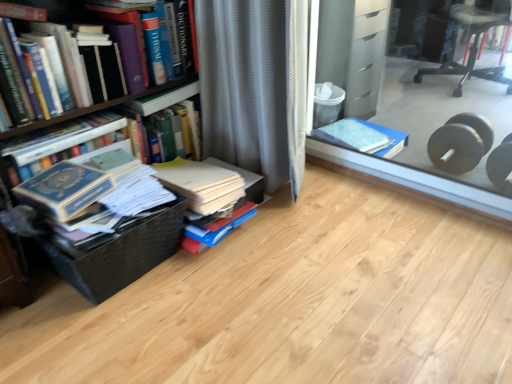
Find the location of `black woven basket at lower left`. black woven basket at lower left is located at coordinates (117, 252).

Image resolution: width=512 pixels, height=384 pixels. What do you see at coordinates (471, 47) in the screenshot?
I see `black plastic chair at upper right` at bounding box center [471, 47].

Find the location of a particular element. This screenshot has width=512, height=384. black woven basket at lower left is located at coordinates (117, 252).

Consider the image. Which object is wider, hardcover book at left, arranged as the 2th book when viewed from the left, or blue cardboard box at center?

Wider between the two is blue cardboard box at center.

In order to click on glass box located behind the hardcover book at left, arranged as the 2th book when viewed from the left in this screenshot , I will do `click(425, 94)`.

Is blue cardboard box at center inside hardcover book at left, the third book viewed from the right?

No, blue cardboard box at center is located outside of hardcover book at left, the third book viewed from the right.

Is hardcover book at left, arranged as the 2th book when viewed from the left, facing away from blue cardboard box at center?

No, hardcover book at left, arranged as the 2th book when viewed from the left, is not facing away from blue cardboard box at center.

Considering the relative sizes of wooden bookcase at left and hardcover book at left, the third book viewed from the right, in the image provided, is wooden bookcase at left thinner than hardcover book at left, the third book viewed from the right,?

Result: No, wooden bookcase at left is not thinner than hardcover book at left, the third book viewed from the right.

Can you tell me how much wooden bookcase at left and hardcover book at left, arranged as the 2th book when viewed from the left, differ in facing direction?

wooden bookcase at left and hardcover book at left, arranged as the 2th book when viewed from the left, are facing 0.973 degrees away from each other.

Is wooden bookcase at left positioned beyond the bounds of hardcover book at left, arranged as the 2th book when viewed from the left?

Yes, wooden bookcase at left is outside of hardcover book at left, arranged as the 2th book when viewed from the left.

Is wooden bookcase at left next to hardcover book at left, the third book viewed from the right?

Absolutely, wooden bookcase at left is next to and touching hardcover book at left, the third book viewed from the right.

Measure the distance between blue cardboard box at center and hardcover book at left, the third book viewed from the right.

blue cardboard box at center is 1.25 meters from hardcover book at left, the third book viewed from the right.

From the image's perspective, would you say blue cardboard box at center is positioned over hardcover book at left, the third book viewed from the right?

Yes.

From the picture: Would you say hardcover book at left, the third book viewed from the right, is part of blue cardboard box at center's contents?

No, hardcover book at left, the third book viewed from the right, is located outside of blue cardboard box at center.

Is blue cardboard box at center further to camera compared to hardcover book at left, the third book viewed from the right?

Yes, blue cardboard box at center is further from the viewer.

Considering the sizes of silver metallic dumbbell at right and blue matte book at upper right, which is counted as the 1th book, starting from the right, in the image, is silver metallic dumbbell at right taller or shorter than blue matte book at upper right, which is counted as the 1th book, starting from the right,?

Considering their sizes, silver metallic dumbbell at right has more height than blue matte book at upper right, which is counted as the 1th book, starting from the right.

Between silver metallic dumbbell at right and blue matte book at upper right, which is counted as the 1th book, starting from the right, which one has smaller size?

silver metallic dumbbell at right.

The image size is (512, 384). What are the coordinates of `the 1st book to the left when counting from the silver metallic dumbbell at right` in the screenshot? It's located at (364, 137).

Does silver metallic dumbbell at right turn towards blue matte book at upper right, the 4th book viewed from the left?

No, silver metallic dumbbell at right does not turn towards blue matte book at upper right, the 4th book viewed from the left.

Does black plastic chair at upper right turn towards hardcover book at left, arranged as the 2th book when viewed from the left?

Yes, black plastic chair at upper right is oriented towards hardcover book at left, arranged as the 2th book when viewed from the left.

Can you tell me how much black plastic chair at upper right and hardcover book at left, the third book viewed from the right, differ in facing direction?

The facing directions of black plastic chair at upper right and hardcover book at left, the third book viewed from the right, are 113 degrees apart.

Is black plastic chair at upper right far from hardcover book at left, the third book viewed from the right?

Absolutely, black plastic chair at upper right is distant from hardcover book at left, the third book viewed from the right.

Is black plastic chair at upper right in front of or behind hardcover book at left, the third book viewed from the right, in the image?

In the image, black plastic chair at upper right appears behind hardcover book at left, the third book viewed from the right.

Is wooden bookcase at left positioned far away from hardcover book at left, arranged as the 1th book when viewed from the left?

That's not correct — wooden bookcase at left is a little close to hardcover book at left, arranged as the 1th book when viewed from the left.

Considering the sizes of objects wooden bookcase at left and hardcover book at left, arranged as the 1th book when viewed from the left, in the image provided, who is wider, wooden bookcase at left or hardcover book at left, arranged as the 1th book when viewed from the left,?

Wider between the two is wooden bookcase at left.

How distant is wooden bookcase at left from hardcover book at left, the 4th book from the right?

wooden bookcase at left and hardcover book at left, the 4th book from the right, are 1.99 inches apart.

In terms of size, does black plastic chair at upper right appear bigger or smaller than blue cardboard box at center?

Clearly, black plastic chair at upper right is smaller in size than blue cardboard box at center.

In the scene shown: Is black plastic chair at upper right to the left of blue cardboard box at center from the viewer's perspective?

Incorrect, black plastic chair at upper right is not on the left side of blue cardboard box at center.

From the image's perspective, between black plastic chair at upper right and blue cardboard box at center, who is located below?

blue cardboard box at center is shown below in the image.

Locate an element on the screen. The image size is (512, 384). the 3rd book to the left when counting from the blue cardboard box at center is located at coordinates (105, 68).

At what (x,y) coordinates should I click in order to perform the action: click on book above the wooden bookcase at left (from a real-world perspective). Please return your answer as a coordinate pair (x, y). This screenshot has width=512, height=384. Looking at the image, I should click on (105, 68).

From the picture: Based on their spatial positions, is hardcover book at left, the third book viewed from the right, or silver metallic dumbbell at right closer to hardcover book at left, the 4th book from the right?

Among the two, hardcover book at left, the third book viewed from the right, is located nearer to hardcover book at left, the 4th book from the right.

Which object lies nearer to the anchor point blue cardboard box at center, hardcover book at left, arranged as the 2th book when viewed from the left, or blue matte book at upper right, which is counted as the 1th book, starting from the right?

The object closer to blue cardboard box at center is blue matte book at upper right, which is counted as the 1th book, starting from the right.

From the image, which object appears to be nearer to hardcover book at left, arranged as the 1th book when viewed from the left, white paper at center, which is the third book from left to right, or hardcover book at left, the third book viewed from the right?

Based on the image, hardcover book at left, the third book viewed from the right, appears to be nearer to hardcover book at left, arranged as the 1th book when viewed from the left.

Based on their spatial positions, is black woven basket at lower left or blue matte book at upper right, which is counted as the 1th book, starting from the right, closer to black plastic chair at upper right?

blue matte book at upper right, which is counted as the 1th book, starting from the right, is closer to black plastic chair at upper right.

Considering their positions, is wooden bookcase at left positioned further to gray textured curtain at center than hardcover book at left, arranged as the 1th book when viewed from the left?

The object further to gray textured curtain at center is hardcover book at left, arranged as the 1th book when viewed from the left.

When comparing their distances from blue matte book at upper right, which is counted as the 1th book, starting from the right, does wooden bookcase at left or hardcover book at left, the 4th book from the right, seem further?

hardcover book at left, the 4th book from the right, is further to blue matte book at upper right, which is counted as the 1th book, starting from the right.

Looking at this image, from the image, which object appears to be farther from black woven basket at lower left, hardcover book at left, the 4th book from the right, or silver metallic dumbbell at right?

The object further to black woven basket at lower left is silver metallic dumbbell at right.

When comparing their distances from blue cardboard box at center, does blue matte book at upper right, which is counted as the 1th book, starting from the right, or black plastic chair at upper right seem further?

Among the two, blue matte book at upper right, which is counted as the 1th book, starting from the right, is located further to blue cardboard box at center.

I want to click on bookcase between hardcover book at left, the third book viewed from the right, and white paper at center, which is the third book from left to right, vertically, so click(117, 254).

Find the location of a particular element. basket situated between hardcover book at left, the 4th book from the right, and blue matte book at upper right, which is counted as the 1th book, starting from the right, from left to right is located at coordinates (117, 252).

You are a GUI agent. You are given a task and a screenshot of the screen. Output one action in this format:
    pyautogui.click(x=<x>, y=<y>)
    Task: Click on the curtain between hardcover book at left, arranged as the 2th book when viewed from the left, and black plastic chair at upper right
    The width and height of the screenshot is (512, 384).
    Given the screenshot: What is the action you would take?
    pyautogui.click(x=251, y=88)

At what (x,y) coordinates should I click in order to perform the action: click on curtain between black woven basket at lower left and black plastic chair at upper right from left to right. Please return your answer as a coordinate pair (x, y). Looking at the image, I should click on (251, 88).